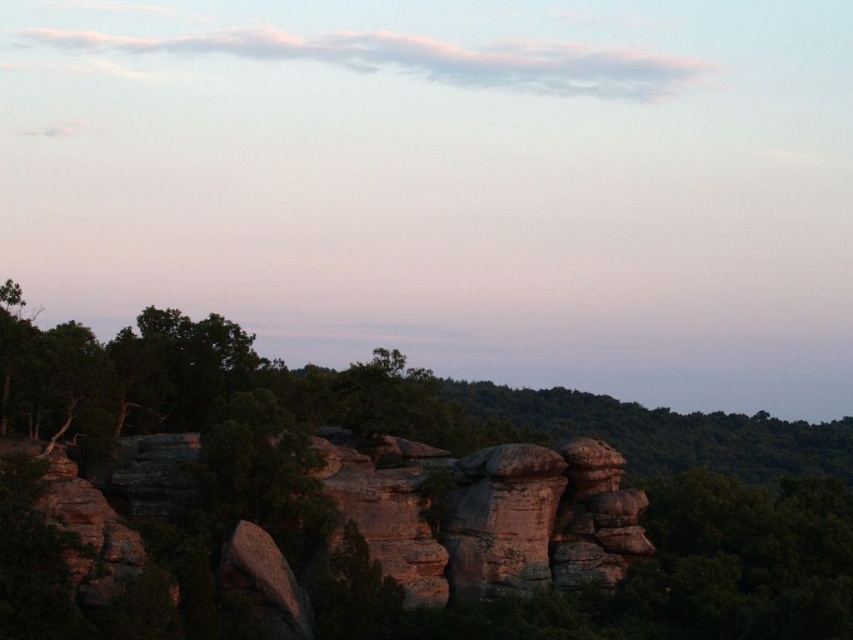
Question: Among these objects, which one is farthest from the camera?

Choices:
 (A) green leafy tree at center
 (B) smooth rock formation at center

Answer: (B)

Question: Does smooth rock formation at center appear under green leafy tree at center?

Choices:
 (A) no
 (B) yes

Answer: (A)

Question: Which point is farther to the camera?

Choices:
 (A) (448, 173)
 (B) (477, 493)

Answer: (A)

Question: Is smooth rock formation at center thinner than green leafy tree at center?

Choices:
 (A) no
 (B) yes

Answer: (A)

Question: From the image, what is the correct spatial relationship of smooth rock formation at center in relation to green leafy tree at center?

Choices:
 (A) below
 (B) above

Answer: (B)